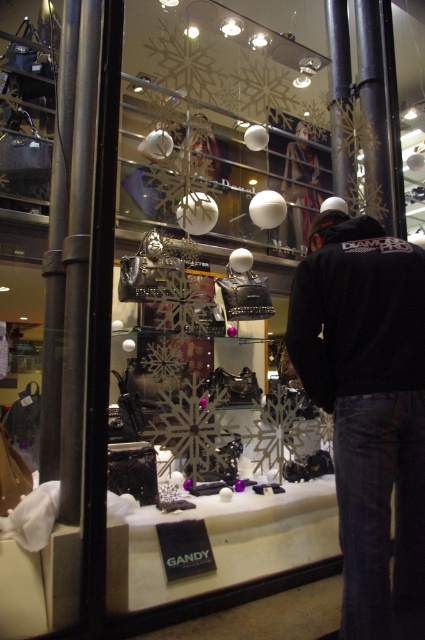
Can you confirm if black fleece jacket at center is wider than black cotton sweatshirt at center?

No.

Does black fleece jacket at center have a lesser height compared to black cotton sweatshirt at center?

No, black fleece jacket at center is not shorter than black cotton sweatshirt at center.

Is point (334, 429) closer to camera compared to point (367, 225)?

Yes, it is in front of point (367, 225).

Where is `black fleece jacket at center`? This screenshot has height=640, width=425. black fleece jacket at center is located at coordinates (368, 408).

Between black fleece jacket at center and matte black jacket at center, which one has less height?

matte black jacket at center is shorter.

Is black fleece jacket at center smaller than matte black jacket at center?

Yes.

Which is in front, point (353, 481) or point (299, 141)?

Point (353, 481)

The height and width of the screenshot is (640, 425). In order to click on black fleece jacket at center in this screenshot , I will do `click(368, 408)`.

Between black cotton sweatshirt at center and matte black jacket at center, which one has less height?

black cotton sweatshirt at center is shorter.

Which is behind, point (328, 365) or point (295, 129)?

The point (295, 129) is more distant.

Find the location of a particular element. The width and height of the screenshot is (425, 640). black cotton sweatshirt at center is located at coordinates (357, 314).